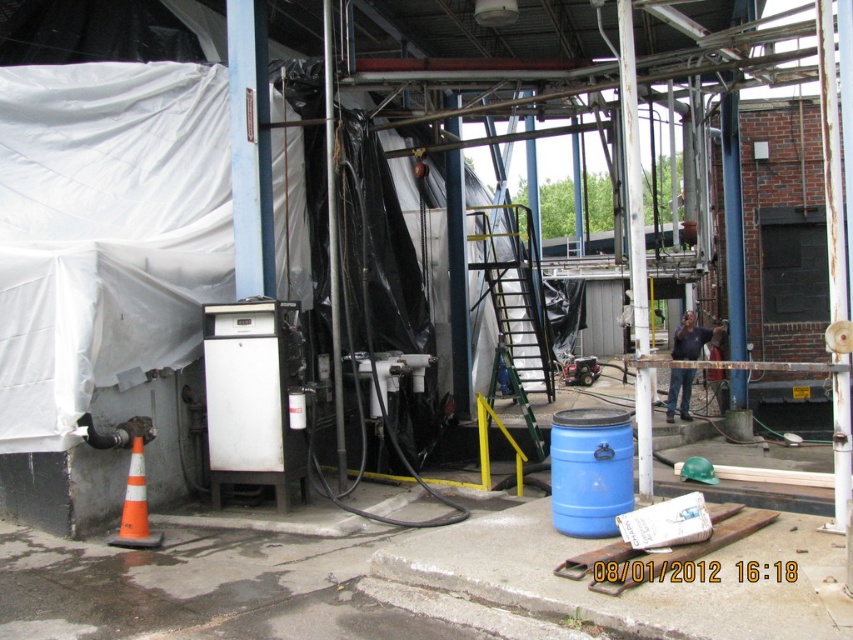
Does blue matte barrel at lower right have a larger size compared to orange plastic traffic cone at lower left?

Yes.

Is blue matte barrel at lower right to the right of orange plastic traffic cone at lower left from the viewer's perspective?

Yes, blue matte barrel at lower right is to the right of orange plastic traffic cone at lower left.

The image size is (853, 640). Describe the element at coordinates (590, 470) in the screenshot. I see `blue matte barrel at lower right` at that location.

This screenshot has width=853, height=640. In order to click on blue matte barrel at lower right in this screenshot , I will do `click(590, 470)`.